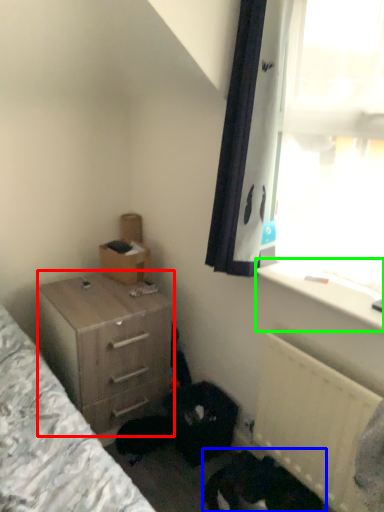
Question: Which object is positioned closest to chest of drawers (highlighted by a red box)? Select from animal (highlighted by a blue box) and window sill (highlighted by a green box).

Choices:
 (A) animal
 (B) window sill

Answer: (A)